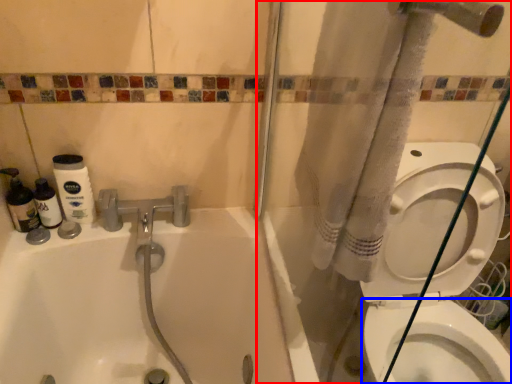
Question: Which point is further to the camera, shower door (highlighted by a red box) or bidet (highlighted by a blue box)?

Choices:
 (A) shower door
 (B) bidet

Answer: (B)